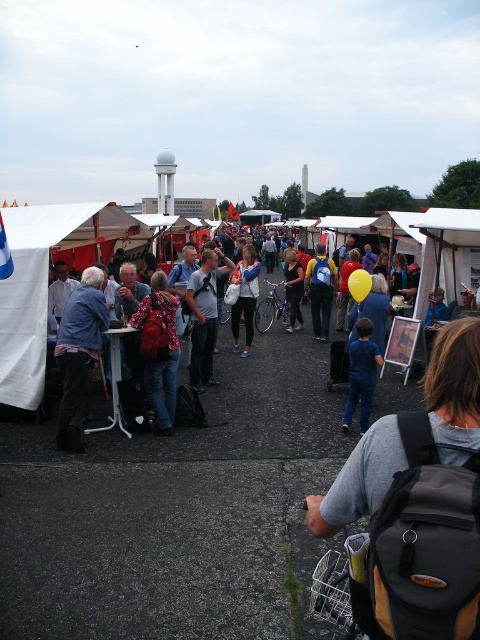
You are a photographer trying to capture both the blue denim jacket at left and the yellow rubber balloon at center in a single shot. Based on their sizes, which object should you focus on first to ensure both are in frame?

The blue denim jacket at left is larger in size than the yellow rubber balloon at center, so you should focus on the blue denim jacket at left first to ensure both are in frame.

From the picture: You are standing in the market and see a person wearing light blue denim jeans at center and carrying a blue backpack at center. Which item is taller?

The light blue denim jeans at center has a greater height compared to the blue backpack at center.

You are a photographer at the outdoor market scene. You want to capture a photo of the person in the gray shirt with the black backpack and yellow strap. However, there is an obstruction at point (204, 316). What part of the person might be blocked by the obstruction?

The obstruction at point (204, 316) is on light blue denim jeans at center, so the lower body or legs of the person in the gray shirt with the black backpack and yellow strap might be blocked.